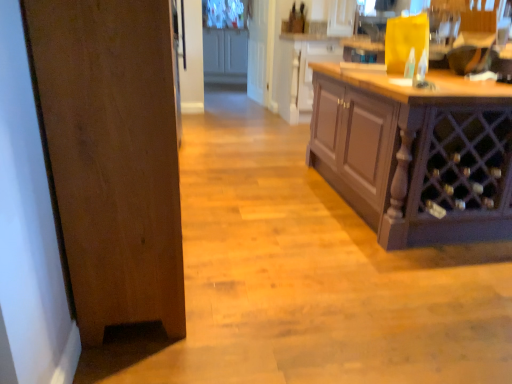
Identify the location of free space to the back side of wooden door at left. The width and height of the screenshot is (512, 384). (232, 198).